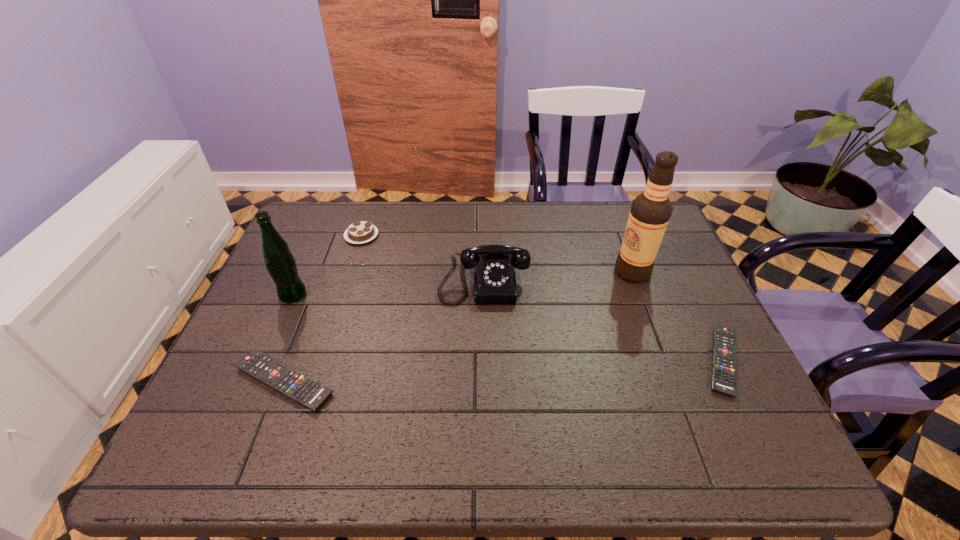
Locate an element on the screen. The height and width of the screenshot is (540, 960). free space for an extra remote_control to achieve even spacing is located at coordinates (508, 371).